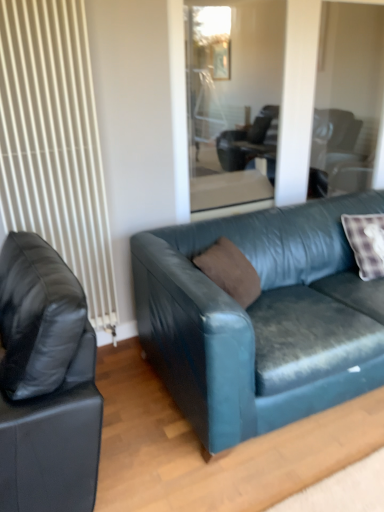
Question: From the image's perspective, would you say brown suede pillow at center is positioned over white ribbed radiator at left?

Choices:
 (A) no
 (B) yes

Answer: (A)

Question: Can you confirm if brown suede pillow at center is bigger than white ribbed radiator at left?

Choices:
 (A) no
 (B) yes

Answer: (A)

Question: Is brown suede pillow at center in contact with white ribbed radiator at left?

Choices:
 (A) yes
 (B) no

Answer: (B)

Question: Does brown suede pillow at center come behind white ribbed radiator at left?

Choices:
 (A) yes
 (B) no

Answer: (A)

Question: Can you confirm if brown suede pillow at center is taller than white ribbed radiator at left?

Choices:
 (A) no
 (B) yes

Answer: (A)

Question: From the image's perspective, is transparent glass door at center located above or below matte black leather couch at left, which ranks as the first studio couch in left-to-right order?

Choices:
 (A) below
 (B) above

Answer: (B)

Question: Considering the positions of transparent glass door at center and matte black leather couch at left, which appears as the second studio couch when viewed from the right, in the image, is transparent glass door at center bigger or smaller than matte black leather couch at left, which appears as the second studio couch when viewed from the right,?

Choices:
 (A) small
 (B) big

Answer: (A)

Question: From a real-world perspective, relative to matte black leather couch at left, which ranks as the first studio couch in left-to-right order, is transparent glass door at center vertically above or below?

Choices:
 (A) below
 (B) above

Answer: (B)

Question: In terms of width, does transparent glass door at center look wider or thinner when compared to matte black leather couch at left, which ranks as the first studio couch in left-to-right order?

Choices:
 (A) wide
 (B) thin

Answer: (B)

Question: Looking at their shapes, would you say brown suede pillow at center is wider or thinner than matte black leather couch at left, which ranks as the first studio couch in left-to-right order?

Choices:
 (A) wide
 (B) thin

Answer: (B)

Question: Is brown suede pillow at center spatially inside matte black leather couch at left, which appears as the second studio couch when viewed from the right, or outside of it?

Choices:
 (A) inside
 (B) outside

Answer: (B)

Question: Considering the positions of brown suede pillow at center and matte black leather couch at left, which ranks as the first studio couch in left-to-right order, in the image, is brown suede pillow at center taller or shorter than matte black leather couch at left, which ranks as the first studio couch in left-to-right order,?

Choices:
 (A) tall
 (B) short

Answer: (B)

Question: Is point (243, 263) closer or farther from the camera than point (57, 384)?

Choices:
 (A) farther
 (B) closer

Answer: (A)

Question: Is brown suede pillow at center in front of or behind transparent glass door at center in the image?

Choices:
 (A) behind
 (B) front

Answer: (B)

Question: Is brown suede pillow at center to the left or to the right of transparent glass door at center in the image?

Choices:
 (A) right
 (B) left

Answer: (B)